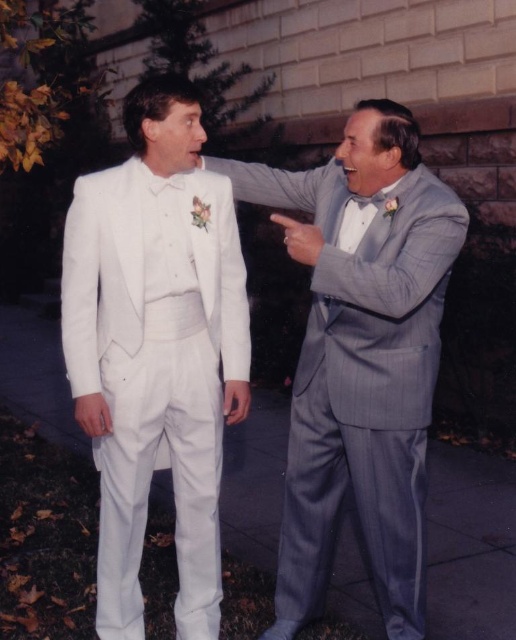
Question: Which object appears closest to the camera in this image?

Choices:
 (A) gray pinstripe suit at right
 (B) gray satin bow tie at upper right
 (C) white satin tuxedo at center

Answer: (A)

Question: Among these points, which one is nearest to the camera?

Choices:
 (A) (353, 198)
 (B) (110, 221)

Answer: (B)

Question: Is gray pinstripe suit at right below gray satin bow tie at upper right?

Choices:
 (A) yes
 (B) no

Answer: (A)

Question: Can you confirm if gray pinstripe suit at right is positioned above gray satin bow tie at upper right?

Choices:
 (A) yes
 (B) no

Answer: (B)

Question: Which is nearer to the gray pinstripe suit at right?

Choices:
 (A) gray satin bow tie at upper right
 (B) white satin tuxedo at center

Answer: (B)

Question: Is gray pinstripe suit at right smaller than gray satin bow tie at upper right?

Choices:
 (A) no
 (B) yes

Answer: (A)